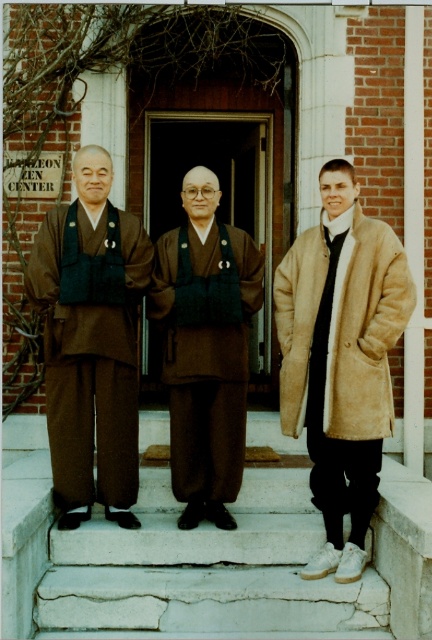
Question: Which is farther from the white stone stairs at center?

Choices:
 (A) brown woolen robe at center
 (B) brown matte kimono at center

Answer: (B)

Question: Among these objects, which one is nearest to the camera?

Choices:
 (A) white stone stairs at center
 (B) brown matte kimono at center
 (C) brown woolen robe at center

Answer: (A)

Question: Among these points, which one is farthest from the camera?

Choices:
 (A) (264, 426)
 (B) (113, 500)
 (C) (235, 384)
 (D) (380, 420)

Answer: (A)

Question: Is white stone stairs at center smaller than brown woolen robe at center?

Choices:
 (A) yes
 (B) no

Answer: (B)

Question: Does white stone stairs at center have a larger size compared to brown matte kimono at center?

Choices:
 (A) no
 (B) yes

Answer: (B)

Question: Does white stone stairs at center appear under brown woolen robe at center?

Choices:
 (A) no
 (B) yes

Answer: (B)